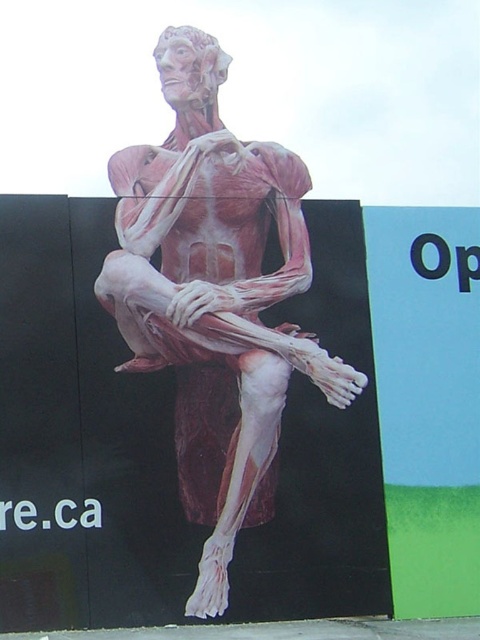
Is pink flesh-like muscle at center further to the viewer compared to blue matte sign at right?

No, it is not.

Locate an element on the screen. This screenshot has height=640, width=480. pink flesh-like muscle at center is located at coordinates (215, 298).